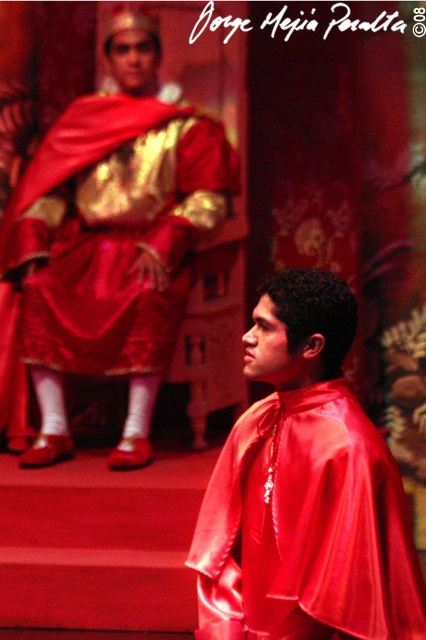
Question: Which object appears farthest from the camera in this image?

Choices:
 (A) satin red cape at center
 (B) satin gold robe at upper left

Answer: (B)

Question: Does satin gold robe at upper left have a larger size compared to satin red cape at center?

Choices:
 (A) no
 (B) yes

Answer: (B)

Question: Is satin gold robe at upper left smaller than satin red cape at center?

Choices:
 (A) no
 (B) yes

Answer: (A)

Question: Does satin gold robe at upper left appear over satin red cape at center?

Choices:
 (A) yes
 (B) no

Answer: (A)

Question: Which point is closer to the camera taking this photo?

Choices:
 (A) (199, 529)
 (B) (127, 262)

Answer: (A)